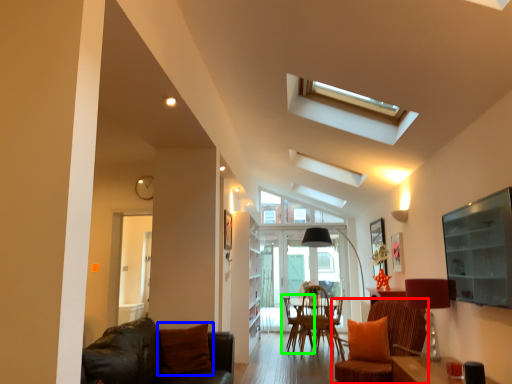
Question: Estimate the real-world distances between objects in this image. Which object is farther from chair (highlighted by a red box), pillow (highlighted by a blue box) or armchair (highlighted by a green box)?

Choices:
 (A) pillow
 (B) armchair

Answer: (B)